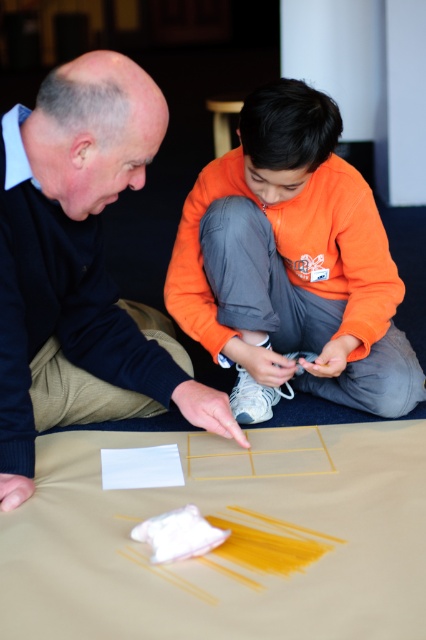
You are designing a new clothing line and need to choose between the matte black sweater at left and the orange fabric at center for a winter collection. Which material would be better for insulation based on their thickness?

The orange fabric at center is thicker than the matte black sweater at left, making it better for insulation in a winter collection.

Where is the matte black sweater at left located in the image?

The matte black sweater at left is located at point (80, 268).